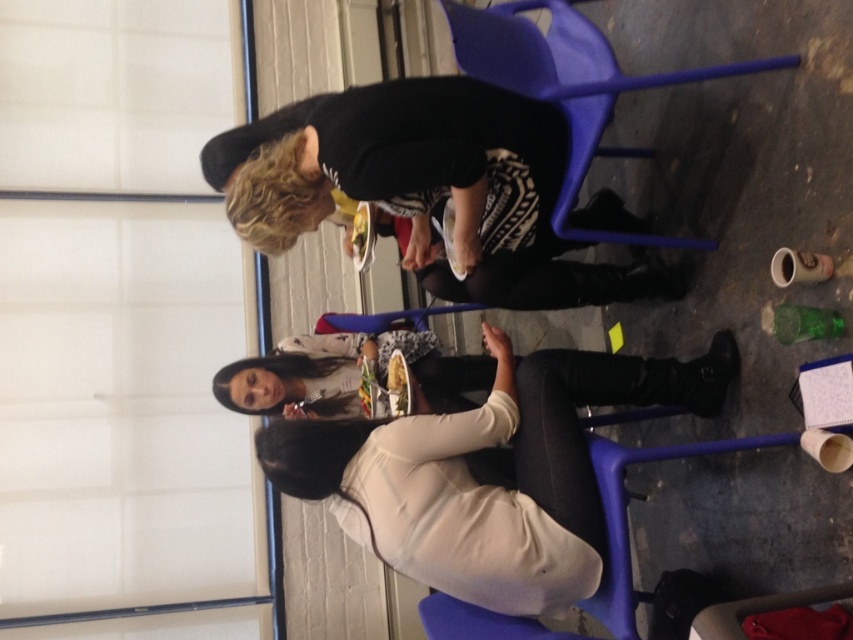
You are a photographer trying to capture a closeup of the matte white sweater at center and the matte blue folding chair at center. Which object should you zoom in on first if you want to focus on the one closer to the camera?

The matte white sweater at center has a lesser height compared to the matte blue folding chair at center, so it is closer to the camera. You should zoom in on the matte white sweater at center first.

You are a photographer standing in the scene and want to take a photo of the matte white sweater at center and the matte blue folding chair at center. Which object will appear larger in the photo?

The matte white sweater at center will appear larger in the photo because it is closer to the viewer than the matte blue folding chair at center.

You are a photographer setting up a shoot in this scene. You need to place a small prop between the matte white sweater at center and the matte blue folding chair at center. Based on their positions, where should you place the prop so it sits between them?

The prop should be placed below the matte blue folding chair at center and above the matte white sweater at center since the matte white sweater at center is located below the matte blue folding chair at center.